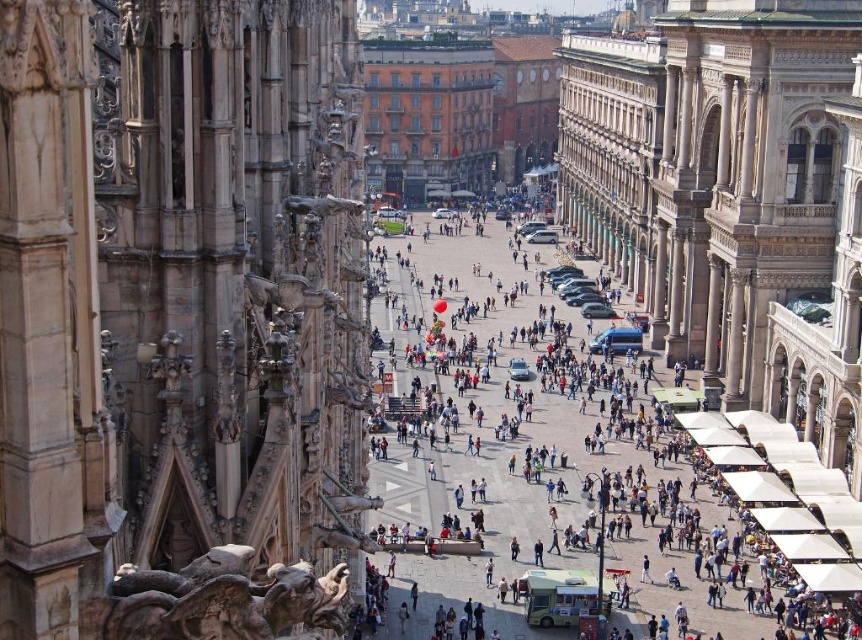
Who is taller, beige stone gargoyle at left or matte white tent at center?

Standing taller between the two is beige stone gargoyle at left.

Is beige stone gargoyle at left positioned at the back of matte white tent at center?

No, beige stone gargoyle at left is closer to the viewer.

Find the location of a particular element. beige stone gargoyle at left is located at coordinates (180, 320).